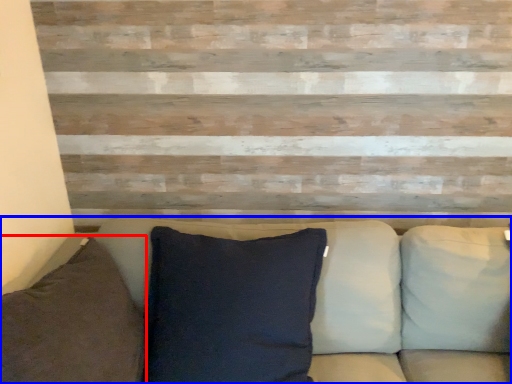
Question: Which object is closer to the camera taking this photo, pillow (highlighted by a red box) or studio couch (highlighted by a blue box)?

Choices:
 (A) pillow
 (B) studio couch

Answer: (A)